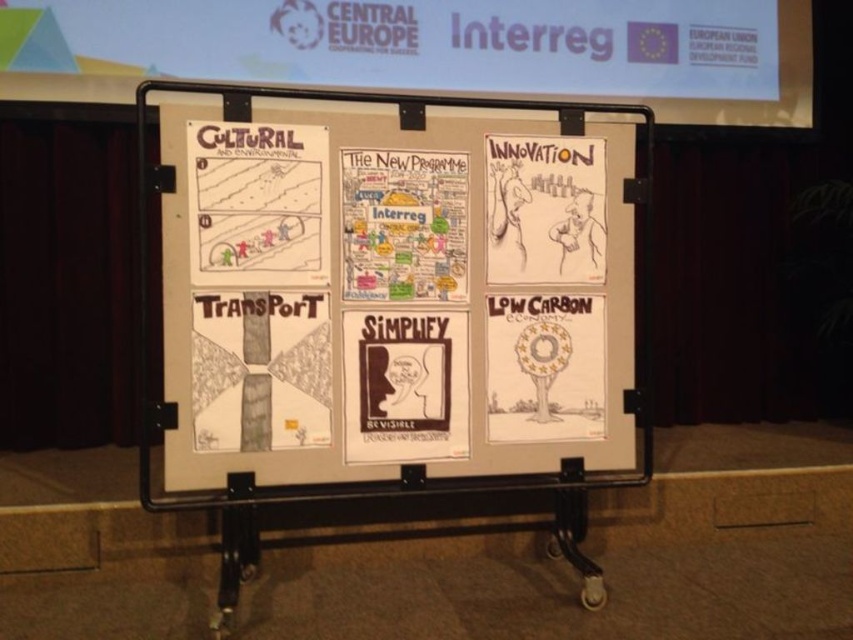
Which is more to the right, white paper at center or white paper poster at center?

white paper at center

Consider the image. Which of these two, white paper at center or white paper poster at center, stands shorter?

With less height is white paper poster at center.

At what (x,y) coordinates should I click in order to perform the action: click on white paper at center. Please return your answer as a coordinate pair (x, y). Image resolution: width=853 pixels, height=640 pixels. Looking at the image, I should click on (392, 294).

The height and width of the screenshot is (640, 853). Identify the location of white paper at center. (392, 294).

Which is in front, point (396, 449) or point (494, 209)?

Point (396, 449) is in front.

Is black paper at center above charcoal sketch innovation at upper right?

Incorrect, black paper at center is not positioned above charcoal sketch innovation at upper right.

Is point (409, 364) positioned in front of point (567, 218)?

Yes, point (409, 364) is in front of point (567, 218).

The image size is (853, 640). Identify the location of black paper at center. (404, 385).

In the scene shown: Which of these two, charcoal sketch innovation at upper right or white paper tree at lower right, stands shorter?

white paper tree at lower right

Can you confirm if charcoal sketch innovation at upper right is shorter than white paper tree at lower right?

No, charcoal sketch innovation at upper right is not shorter than white paper tree at lower right.

Where is `charcoal sketch innovation at upper right`? The height and width of the screenshot is (640, 853). charcoal sketch innovation at upper right is located at coordinates tap(544, 209).

Locate an element on the screen. charcoal sketch innovation at upper right is located at coordinates (544, 209).